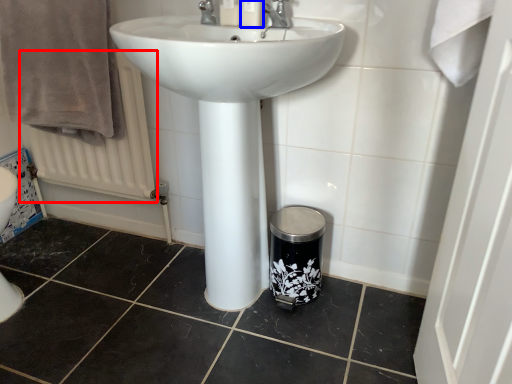
Question: Which point is closer to the camera, radiator (highlighted by a red box) or toiletry (highlighted by a blue box)?

Choices:
 (A) radiator
 (B) toiletry

Answer: (B)